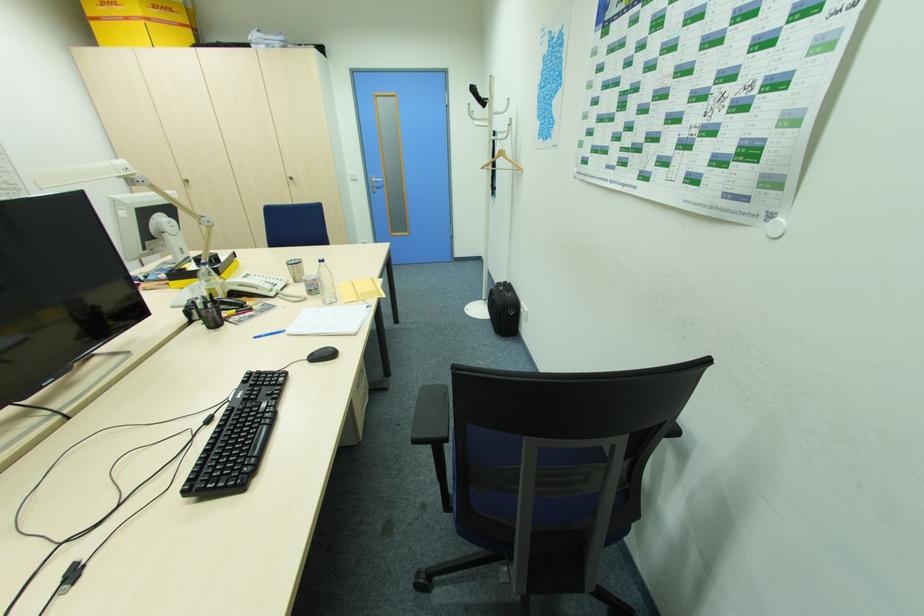
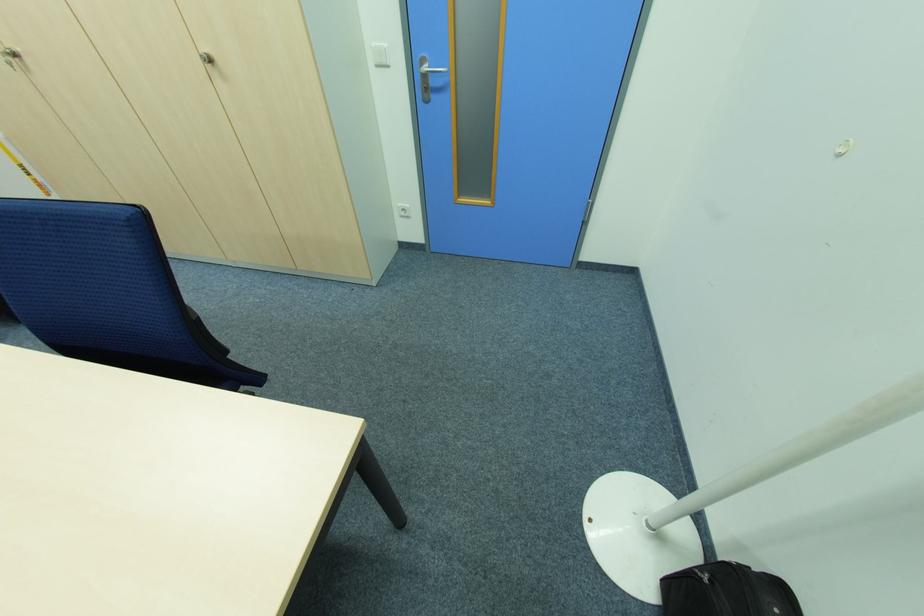
Where in the second image is the point corresponding to point (373, 179) from the first image?

(424, 63)